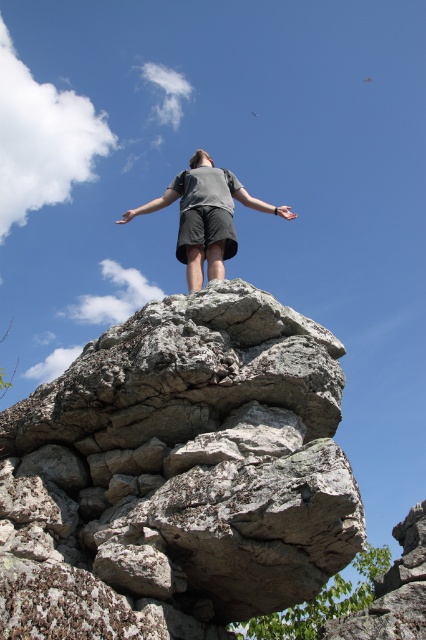
Question: Observing the image, what is the correct spatial positioning of gray rough rock at center in reference to gray matte shorts at center?

Choices:
 (A) above
 (B) below

Answer: (B)

Question: Which object appears farthest from the camera in this image?

Choices:
 (A) gray rough rock at center
 (B) gray matte shorts at center

Answer: (B)

Question: Where is gray rough rock at center located in relation to gray matte shorts at center in the image?

Choices:
 (A) right
 (B) left

Answer: (B)

Question: Can you confirm if gray rough rock at center is positioned above gray matte shorts at center?

Choices:
 (A) no
 (B) yes

Answer: (A)